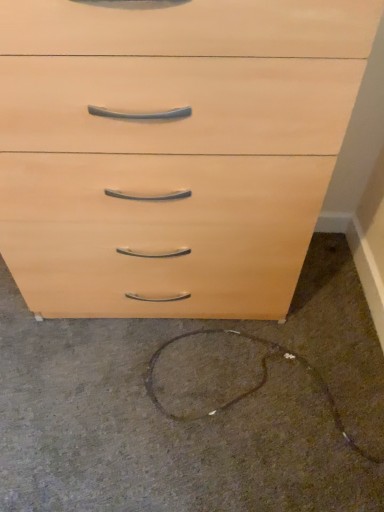
The height and width of the screenshot is (512, 384). Describe the element at coordinates (171, 150) in the screenshot. I see `matte wood chest of drawers at center` at that location.

What are the coordinates of `matte wood chest of drawers at center` in the screenshot? It's located at (171, 150).

This screenshot has height=512, width=384. What are the coordinates of `brown carpet at lower center` in the screenshot? It's located at (194, 406).

Describe the element at coordinates (194, 406) in the screenshot. Image resolution: width=384 pixels, height=512 pixels. I see `brown carpet at lower center` at that location.

This screenshot has width=384, height=512. Find the location of `matte wood chest of drawers at center`. matte wood chest of drawers at center is located at coordinates (171, 150).

In the image, is brown carpet at lower center on the left side or the right side of matte wood chest of drawers at center?

Based on their positions, brown carpet at lower center is located to the right of matte wood chest of drawers at center.

Consider the image. Is brown carpet at lower center further to camera compared to matte wood chest of drawers at center?

Yes, it is behind matte wood chest of drawers at center.

Which point is more forward, (43,397) or (252,220)?

The point (252,220) is closer.

From the image's perspective, which one is positioned higher, brown carpet at lower center or matte wood chest of drawers at center?

matte wood chest of drawers at center, from the image's perspective.

From a real-world perspective, is brown carpet at lower center physically below matte wood chest of drawers at center?

Correct, in the physical world, brown carpet at lower center is lower than matte wood chest of drawers at center.

Is brown carpet at lower center wider or thinner than matte wood chest of drawers at center?

In the image, brown carpet at lower center appears to be wider than matte wood chest of drawers at center.

Based on the photo, is brown carpet at lower center taller or shorter than matte wood chest of drawers at center?

brown carpet at lower center is shorter than matte wood chest of drawers at center.

Consider the image. Does brown carpet at lower center have a smaller size compared to matte wood chest of drawers at center?

Yes.

Is brown carpet at lower center not inside matte wood chest of drawers at center?

brown carpet at lower center lies outside matte wood chest of drawers at center's area.

Would you say brown carpet at lower center is a long distance from matte wood chest of drawers at center?

That's not correct — brown carpet at lower center is a little close to matte wood chest of drawers at center.

Is brown carpet at lower center facing towards matte wood chest of drawers at center?

No, brown carpet at lower center is not facing towards matte wood chest of drawers at center.

How far apart are brown carpet at lower center and matte wood chest of drawers at center?

brown carpet at lower center is 15.39 inches from matte wood chest of drawers at center.

Locate an element on the screen. The height and width of the screenshot is (512, 384). chest of drawers on the left of brown carpet at lower center is located at coordinates (171, 150).

Which is more to the right, matte wood chest of drawers at center or brown carpet at lower center?

→ Positioned to the right is brown carpet at lower center.

Is the position of matte wood chest of drawers at center less distant than that of brown carpet at lower center?

Yes, it is.

Which is in front, point (332, 86) or point (122, 352)?

Positioned in front is point (332, 86).

From the image's perspective, relative to brown carpet at lower center, is matte wood chest of drawers at center above or below?

matte wood chest of drawers at center is situated higher than brown carpet at lower center in the image.

From a real-world perspective, is matte wood chest of drawers at center on brown carpet at lower center?

Yes.

Is matte wood chest of drawers at center wider than brown carpet at lower center?

No, matte wood chest of drawers at center is not wider than brown carpet at lower center.

Considering the relative sizes of matte wood chest of drawers at center and brown carpet at lower center in the image provided, is matte wood chest of drawers at center taller than brown carpet at lower center?

Indeed, matte wood chest of drawers at center has a greater height compared to brown carpet at lower center.

Between matte wood chest of drawers at center and brown carpet at lower center, which one has larger size?

With larger size is matte wood chest of drawers at center.

Would you say brown carpet at lower center is part of matte wood chest of drawers at center's contents?

No.

Does matte wood chest of drawers at center touch brown carpet at lower center?

No, matte wood chest of drawers at center is not touching brown carpet at lower center.

Looking at this image, could you tell me if matte wood chest of drawers at center is facing brown carpet at lower center?

No, matte wood chest of drawers at center is not oriented towards brown carpet at lower center.

Measure the distance from matte wood chest of drawers at center to brown carpet at lower center.

A distance of 15.39 inches exists between matte wood chest of drawers at center and brown carpet at lower center.

Identify the location of chest of drawers located on the left of brown carpet at lower center. Image resolution: width=384 pixels, height=512 pixels. (171, 150).

This screenshot has width=384, height=512. I want to click on concrete behind the matte wood chest of drawers at center, so click(194, 406).

Locate an element on the screen. This screenshot has width=384, height=512. chest of drawers in front of the brown carpet at lower center is located at coordinates (171, 150).